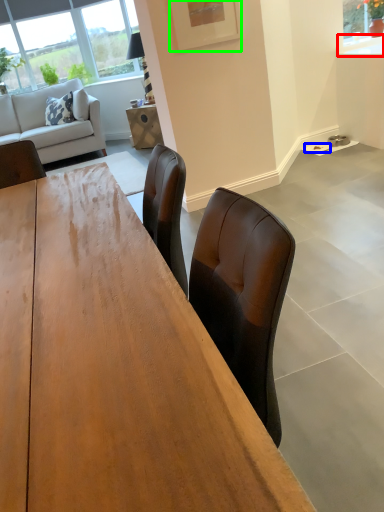
Question: Considering the real-world distances, which object is farthest from counter top (highlighted by a red box)? plate (highlighted by a blue box) or picture frame (highlighted by a green box)?

Choices:
 (A) plate
 (B) picture frame

Answer: (B)